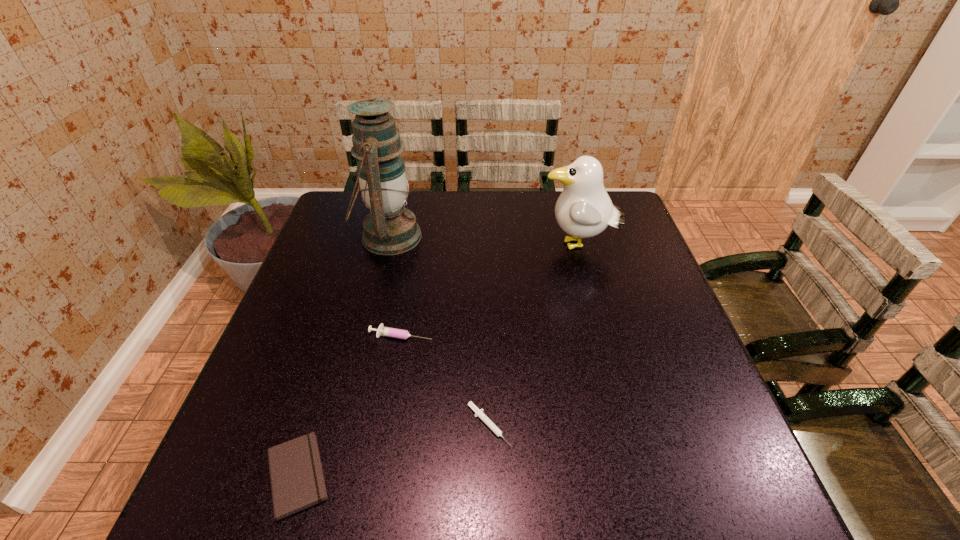
Locate an element on the screen. This screenshot has height=540, width=960. vacant space that is in between the oil lamp and the gull is located at coordinates (483, 241).

Identify the location of blank region between the shorter syringe and the checkbook. (393, 450).

The image size is (960, 540). Find the location of `free point between the fourth shortest object and the tallest object`. free point between the fourth shortest object and the tallest object is located at coordinates (483, 241).

Locate an element on the screen. This screenshot has width=960, height=540. free space that is in between the tallest object and the shorter syringe is located at coordinates (439, 331).

At what (x,y) coordinates should I click in order to perform the action: click on free space that is in between the checkbook and the rightmost object. Please return your answer as a coordinate pair (x, y). The width and height of the screenshot is (960, 540). Looking at the image, I should click on (437, 361).

Identify the location of free spot between the second tallest object and the fourth object from left to right. This screenshot has height=540, width=960. (534, 336).

Find the location of a particular element. vacant area that lies between the oil lamp and the gull is located at coordinates (483, 241).

Find the location of a particular element. free space between the gull and the nearer syringe is located at coordinates (534, 336).

This screenshot has width=960, height=540. What are the coordinates of `vacant region between the tallest object and the checkbook` in the screenshot? It's located at (343, 356).

Identify the location of object that stands as the fourth closest to the farther syringe. The width and height of the screenshot is (960, 540). (584, 209).